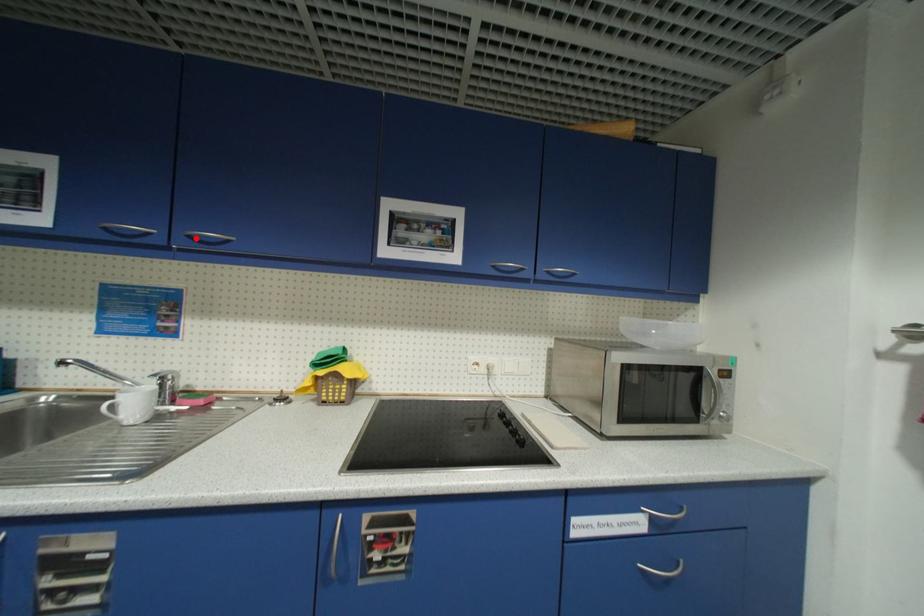
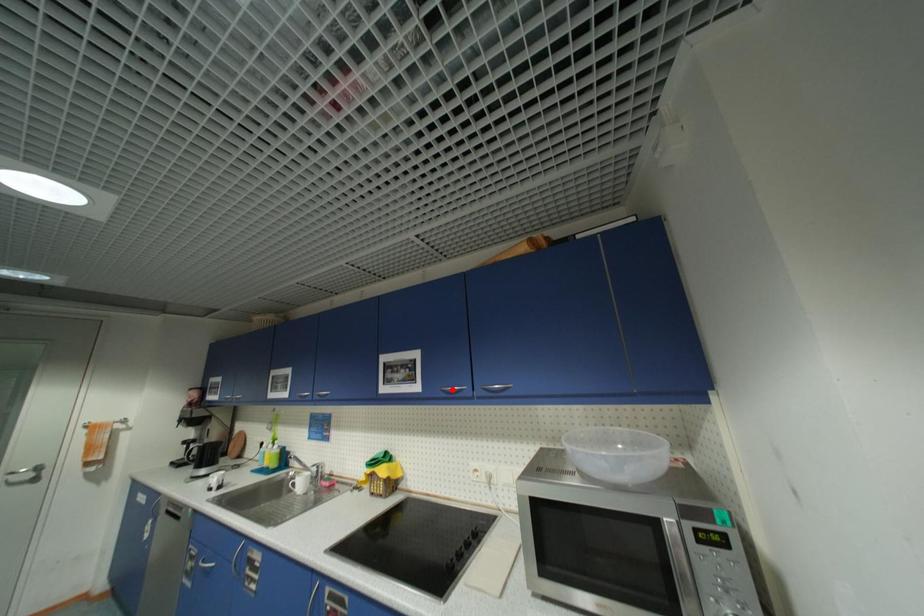
I am providing you with two images of the same scene from different viewpoints. A red point is marked on the first image and another point is marked on the second image. Do the highlighted points in image1 and image2 indicate the same real-world spot?

No